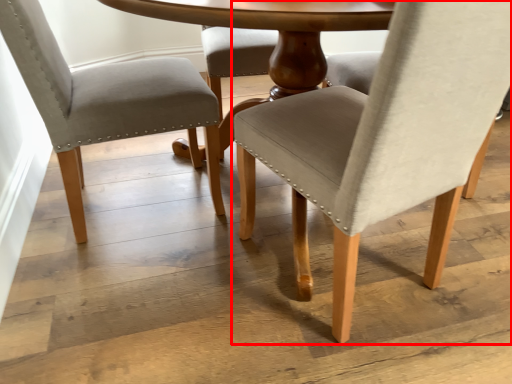
Question: Considering the relative positions of chair (annotated by the red box) and chair in the image provided, where is chair (annotated by the red box) located with respect to the staircase?

Choices:
 (A) left
 (B) right

Answer: (B)